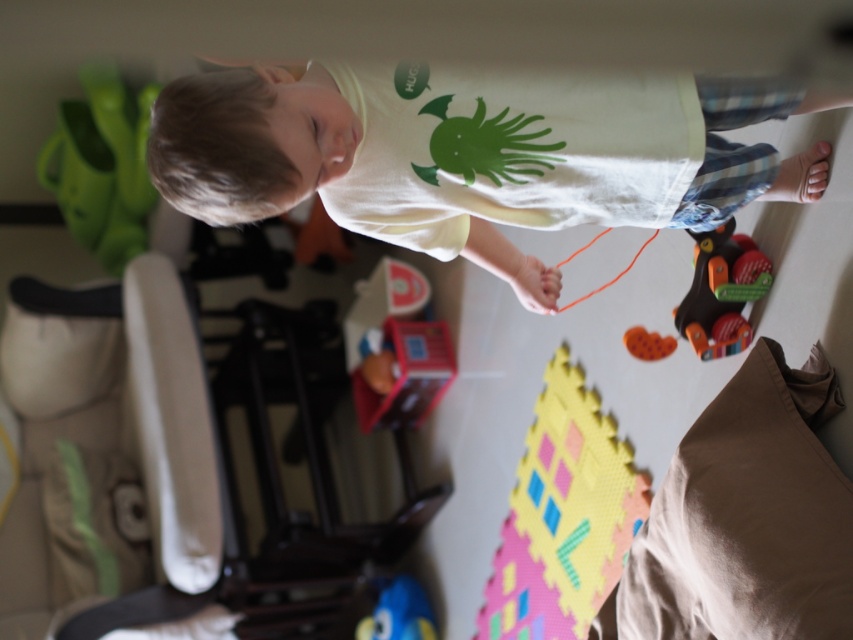
You are a parent trying to choose a toy for your child to play with. You see the rubberized foam puzzle piece at lower center and the orange rubber toy at lower center. Which one is bigger?

The rubberized foam puzzle piece at lower center is larger in size than the orange rubber toy at lower center.

You are a drone operator trying to deliver a small toy to a specific location in the playroom. The target location is at point [607,545]. Your drone can only hover at a minimum height of 5 feet above the ground. Based on the scene, will your drone be able to hover at the required height while reaching that point?

The distance between the point [607,545] and the camera is 6.79 feet. Since the drone needs to hover at a minimum of 5 feet, the drone can hover at the required height as 6.79 feet is greater than 5 feet.

You are a parent trying to tidy up the playroom. You see the blue rubber duck at lower center and the orange string at lower center. Which object is closer to the left side of the playroom?

The blue rubber duck at lower center is closer to the left side of the playroom because it is positioned to the left of the orange string at lower center.